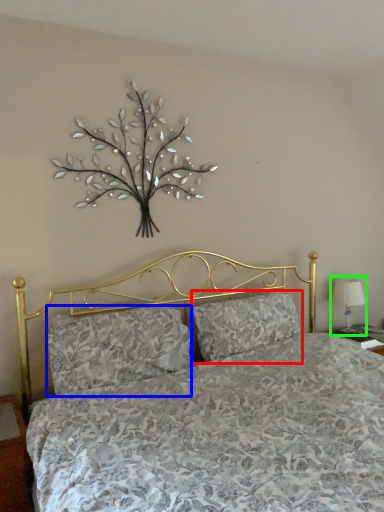
Question: Which object is the closest to the pillow (highlighted by a red box)? Choose among these: pillow (highlighted by a blue box) or table lamp (highlighted by a green box).

Choices:
 (A) pillow
 (B) table lamp

Answer: (A)